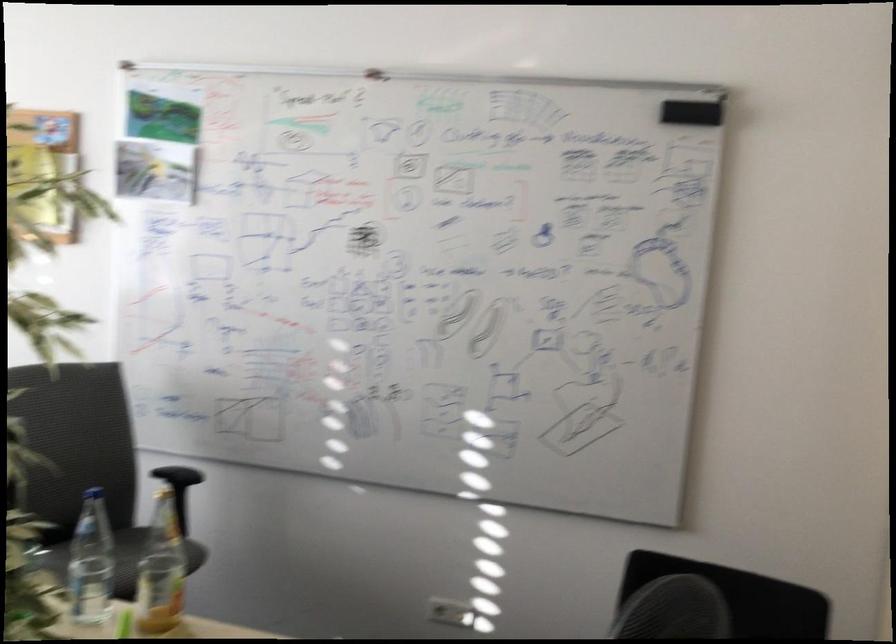
The image size is (896, 644). What do you see at coordinates (177, 471) in the screenshot?
I see `the black chair armrest` at bounding box center [177, 471].